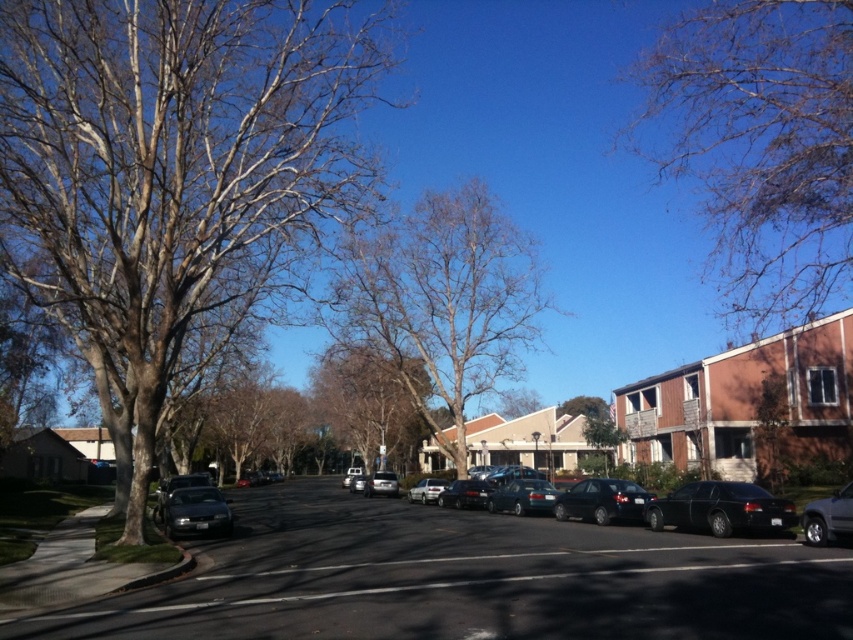
Question: Which object is closer to the camera taking this photo?

Choices:
 (A) metallic teal sedan at center
 (B) satin black sedan at lower left
 (C) brown wood tree at center

Answer: (B)

Question: Is bare wood tree at center positioned before brown leafless tree at center?

Choices:
 (A) yes
 (B) no

Answer: (A)

Question: Which point is farther from the camera taking this photo?

Choices:
 (A) [x=498, y=404]
 (B) [x=711, y=497]

Answer: (A)

Question: Is glossy black sedan at right thinner than metallic teal sedan at center?

Choices:
 (A) no
 (B) yes

Answer: (B)

Question: Which object is positioned farthest from the silver metallic car at center?

Choices:
 (A) bare branches at upper right
 (B) satin black sedan at center
 (C) bare wood tree at center
 (D) green leafy tree at center

Answer: (D)

Question: Does glossy black sedan at right appear on the left side of silver metallic car at center?

Choices:
 (A) yes
 (B) no

Answer: (B)